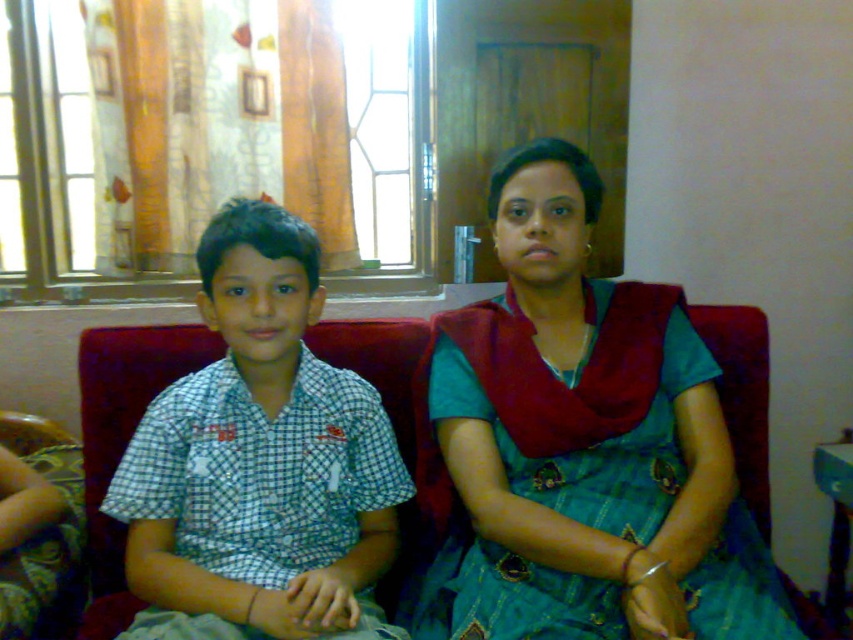
Who is lower down, teal silk saree at center or red fabric couch at center?

red fabric couch at center is below.

Can you confirm if teal silk saree at center is wider than red fabric couch at center?

Incorrect, teal silk saree at center's width does not surpass red fabric couch at center's.

Is point (718, 497) in front of point (115, 534)?

Yes, it is in front of point (115, 534).

In order to click on teal silk saree at center in this screenshot , I will do (582, 445).

Who is higher up, checkered fabric shirt at left or red fabric couch at center?

checkered fabric shirt at left is higher up.

What do you see at coordinates (260, 461) in the screenshot? This screenshot has width=853, height=640. I see `checkered fabric shirt at left` at bounding box center [260, 461].

Where is `checkered fabric shirt at left`? checkered fabric shirt at left is located at coordinates (260, 461).

Is teal silk saree at center positioned in front of checkered fabric shirt at left?

Yes, it is in front of checkered fabric shirt at left.

Is point (660, 461) positioned before point (167, 403)?

Yes, it is in front of point (167, 403).

Find the location of a particular element. The width and height of the screenshot is (853, 640). teal silk saree at center is located at coordinates (582, 445).